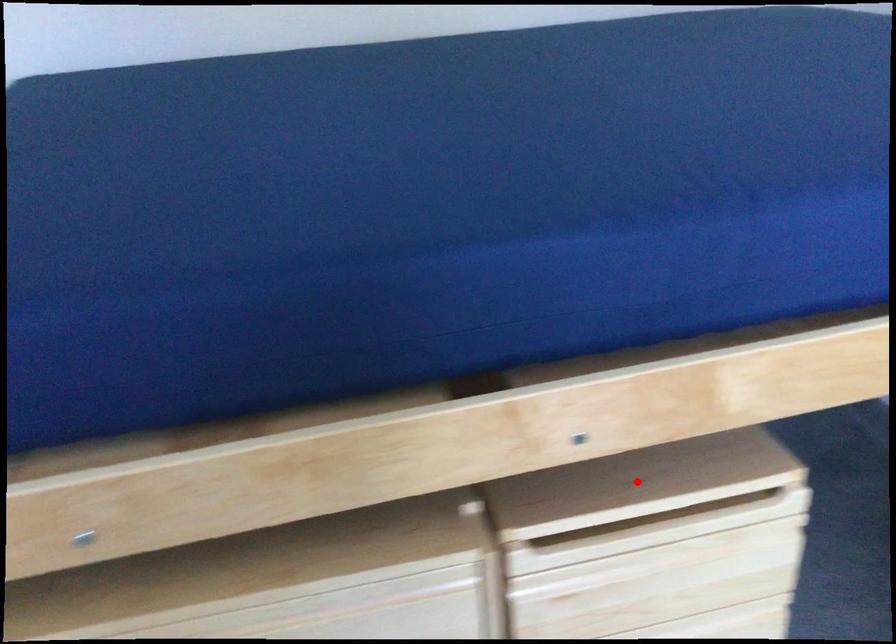
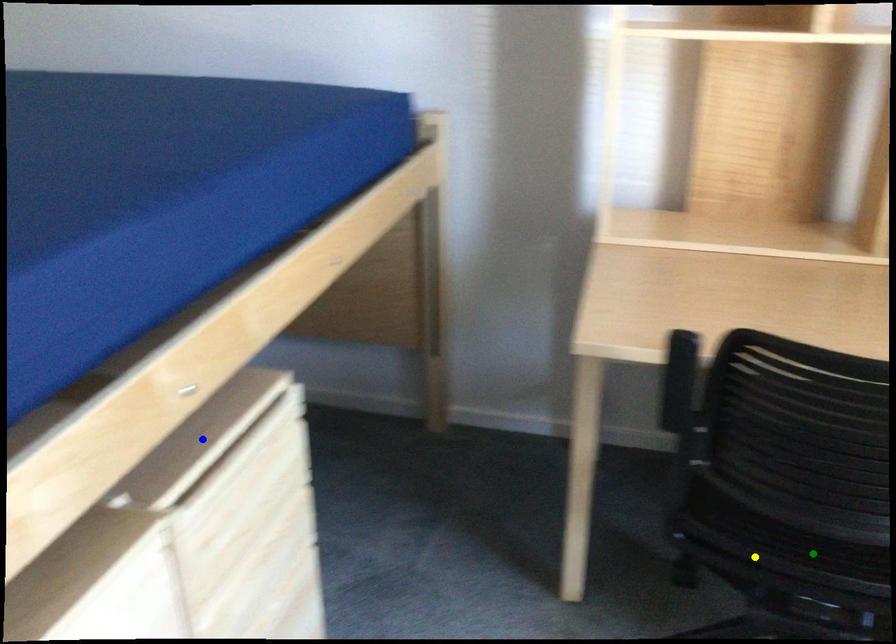
Question: I am providing you with two images of the same scene from different viewpoints. A red point is marked on the first image. You are given multiple points on the second image. Which mark in image 2 goes with the point in image 1?

Choices:
 (A) yellow point
 (B) blue point
 (C) green point

Answer: (B)